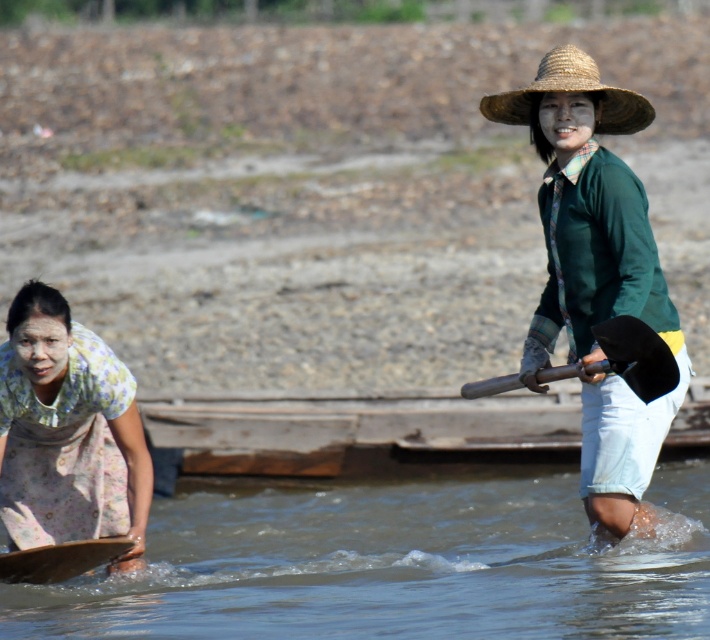
Question: Can you confirm if green matte shirt at center is positioned above black rubber paddle at right?

Choices:
 (A) yes
 (B) no

Answer: (A)

Question: Among these objects, which one is nearest to the camera?

Choices:
 (A) clear water at lower center
 (B) floral fabric skirt at lower left
 (C) strawmaterial/texturehat at upper center

Answer: (A)

Question: Does strawmaterial/texturehat at upper center appear under black rubber paddle at right?

Choices:
 (A) no
 (B) yes

Answer: (A)

Question: Which of the following is the farthest from the observer?

Choices:
 (A) clear water at lower center
 (B) floral fabric skirt at lower left

Answer: (B)

Question: Which of these objects is positioned farthest from the green matte shirt at center?

Choices:
 (A) clear water at lower center
 (B) floral fabric skirt at lower left
 (C) strawmaterial/texturehat at upper center

Answer: (A)

Question: Does clear water at lower center have a smaller size compared to black rubber paddle at right?

Choices:
 (A) yes
 (B) no

Answer: (B)